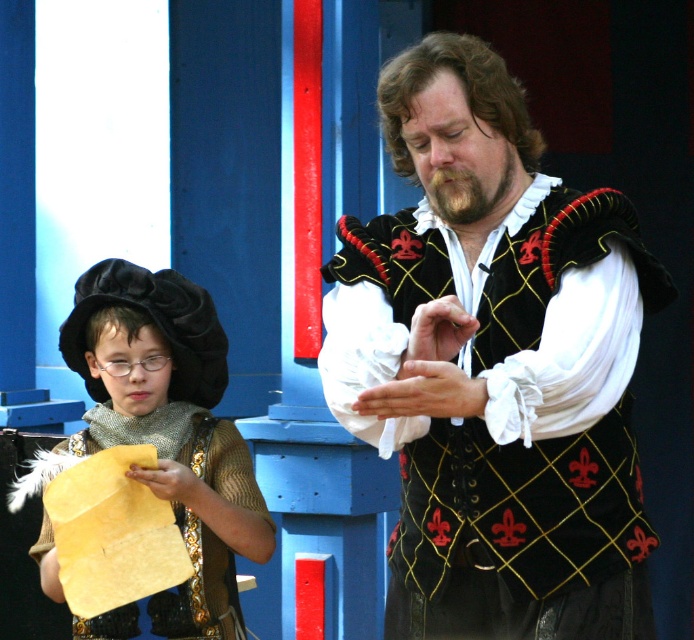
Question: Does black velvet vest at center appear on the right side of matte gold paper at left?

Choices:
 (A) no
 (B) yes

Answer: (B)

Question: Which point is farther from the camera taking this photo?

Choices:
 (A) (228, 456)
 (B) (518, 236)

Answer: (A)

Question: Which point is closer to the camera?

Choices:
 (A) click(119, 376)
 (B) click(520, 148)

Answer: (B)

Question: Is black velvet vest at center thinner than matte gold paper at left?

Choices:
 (A) no
 (B) yes

Answer: (A)

Question: Among these objects, which one is nearest to the camera?

Choices:
 (A) matte gold paper at left
 (B) black velvet vest at center

Answer: (B)

Question: Is the position of black velvet vest at center more distant than that of matte gold paper at left?

Choices:
 (A) no
 (B) yes

Answer: (A)